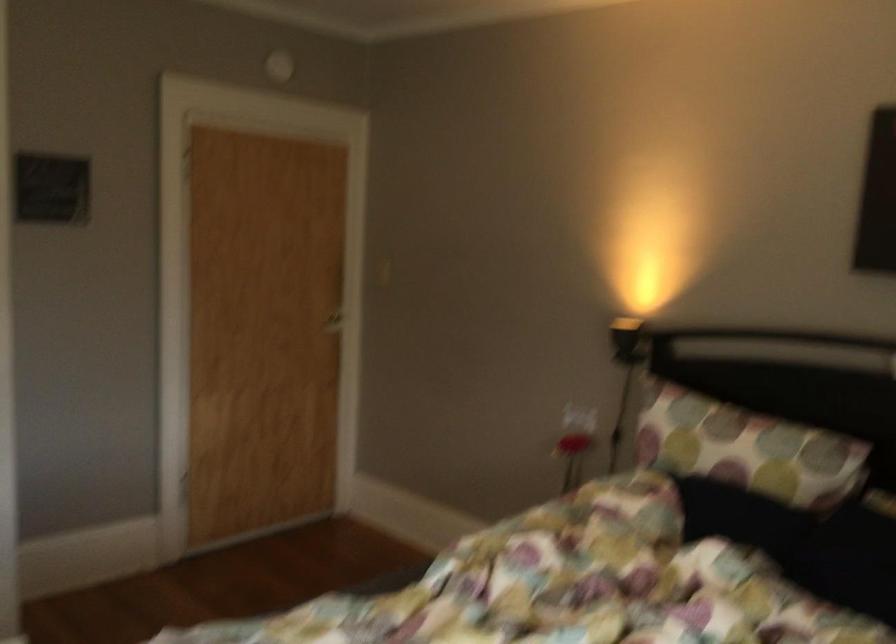
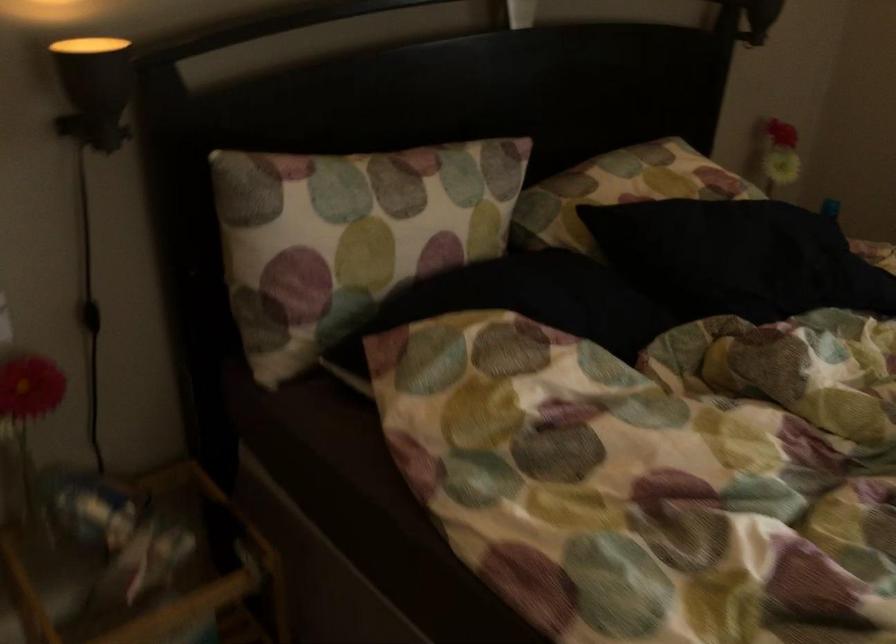
Find the pixel in the second image that matches the point at 625,436 in the first image.

(90, 316)